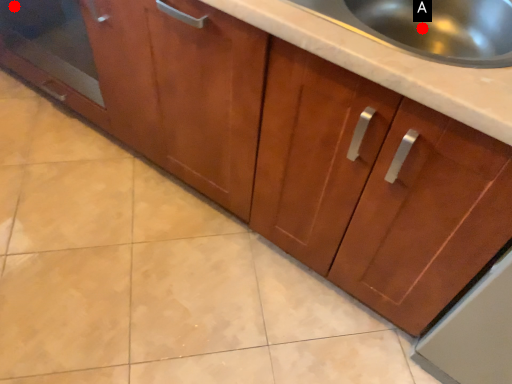
Question: Two points are circled on the image, labeled by A and B beside each circle. Which point appears farthest from the camera in this image?

Choices:
 (A) A is further
 (B) B is further

Answer: (B)